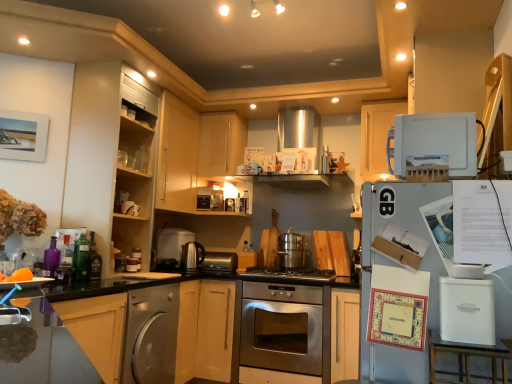
Question: Based on their sizes in the image, would you say green glass bottle at left, which is the 2th bottle from back to front, is bigger or smaller than satin silver dishwasher at lower left?

Choices:
 (A) small
 (B) big

Answer: (A)

Question: Considering the positions of green glass bottle at left, placed as the fourth bottle when sorted from left to right, and satin silver dishwasher at lower left in the image, is green glass bottle at left, placed as the fourth bottle when sorted from left to right, wider or thinner than satin silver dishwasher at lower left?

Choices:
 (A) thin
 (B) wide

Answer: (A)

Question: Which of these objects is positioned closest to the satin silver toaster at center, the second appliance viewed from the back?

Choices:
 (A) metallic silver kettle at center, which is counted as the second appliance, starting from the right
 (B) satin nickel kettle at center, which is the third appliance in back-to-front order
 (C) orange matte fruit at lower left
 (D) translucent glass bottle at left, which is counted as the 4th bottle, starting from the right
 (E) stainless steel oven at center

Answer: (B)

Question: Which of these objects is positioned closest to the satin silver toaster at center, which is counted as the 3th appliance, starting from the right?

Choices:
 (A) satin nickel kettle at center, the third appliance in the front-to-back sequence
 (B) metallic silver kettle at center, marked as the 4th appliance in a back-to-front arrangement
 (C) green glass bottle at lower left, the 3th bottle viewed from the left
 (D) orange matte fruit at lower left
 (E) matte wood cabinet at upper center, acting as the 2th cabinetry starting from the left

Answer: (A)